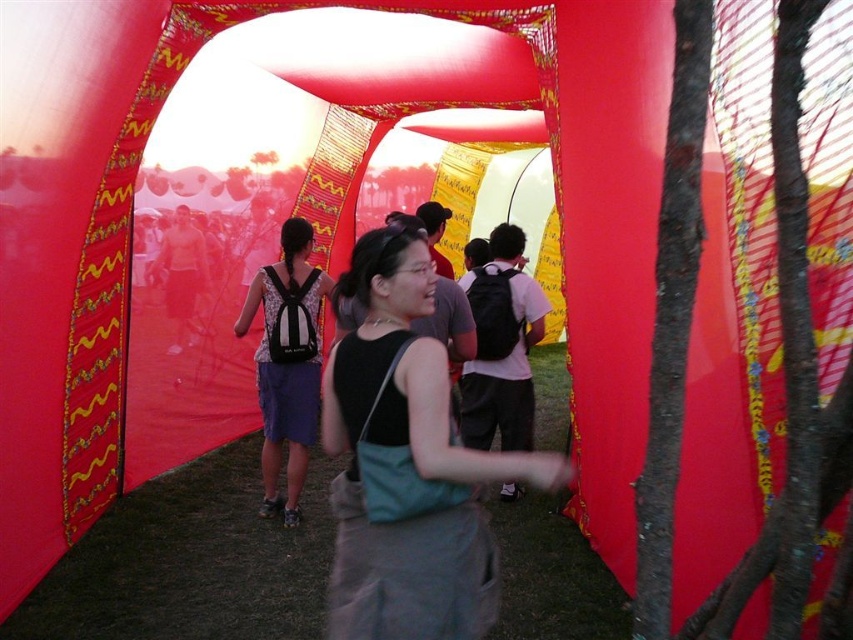
Between point (549, 476) and point (276, 381), which one is positioned in front?

Point (549, 476) is more forward.

Is black fabric bag at center wider than matte black backpack at center?

Indeed, black fabric bag at center has a greater width compared to matte black backpack at center.

Where is `black fabric bag at center`? black fabric bag at center is located at coordinates (412, 461).

Where is `black fabric bag at center`? The image size is (853, 640). black fabric bag at center is located at coordinates (412, 461).